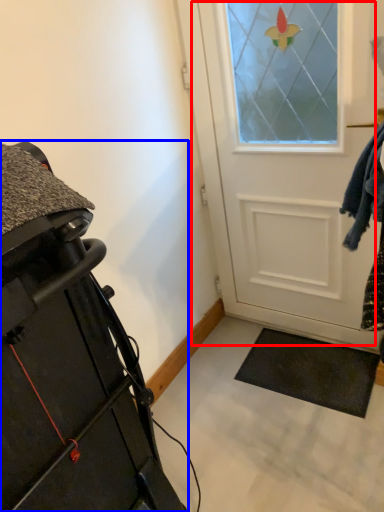
Question: Among these objects, which one is farthest to the camera, door (highlighted by a red box) or furniture (highlighted by a blue box)?

Choices:
 (A) door
 (B) furniture

Answer: (A)